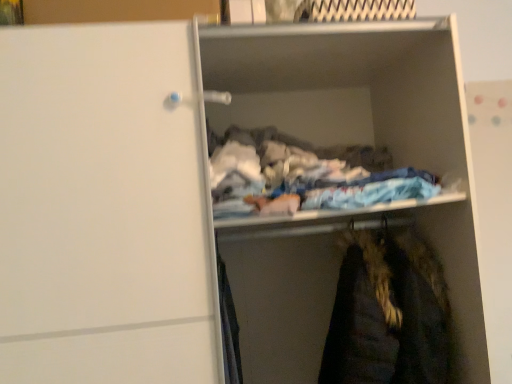
Question: Is velvet-like dark brown coat at lower right located outside white matte clothes at center?

Choices:
 (A) yes
 (B) no

Answer: (A)

Question: Would you consider velvet-like dark brown coat at lower right to be distant from white matte clothes at center?

Choices:
 (A) no
 (B) yes

Answer: (A)

Question: Is velvet-like dark brown coat at lower right closer to camera compared to white matte clothes at center?

Choices:
 (A) yes
 (B) no

Answer: (B)

Question: Can you see velvet-like dark brown coat at lower right touching white matte clothes at center?

Choices:
 (A) no
 (B) yes

Answer: (A)

Question: Considering the relative sizes of velvet-like dark brown coat at lower right and white matte clothes at center in the image provided, is velvet-like dark brown coat at lower right smaller than white matte clothes at center?

Choices:
 (A) no
 (B) yes

Answer: (B)

Question: Can you confirm if velvet-like dark brown coat at lower right is positioned to the right of white matte clothes at center?

Choices:
 (A) no
 (B) yes

Answer: (B)

Question: Is white matte clothes at center thinner than velvet-like dark brown coat at lower right?

Choices:
 (A) no
 (B) yes

Answer: (B)

Question: Is velvet-like dark brown coat at lower right inside white matte clothes at center?

Choices:
 (A) no
 (B) yes

Answer: (A)

Question: Does white matte clothes at center have a greater height compared to velvet-like dark brown coat at lower right?

Choices:
 (A) no
 (B) yes

Answer: (A)

Question: Considering the relative sizes of white matte clothes at center and velvet-like dark brown coat at lower right in the image provided, is white matte clothes at center smaller than velvet-like dark brown coat at lower right?

Choices:
 (A) no
 (B) yes

Answer: (A)

Question: Considering the relative positions of white matte clothes at center and velvet-like dark brown coat at lower right in the image provided, is white matte clothes at center to the right of velvet-like dark brown coat at lower right from the viewer's perspective?

Choices:
 (A) no
 (B) yes

Answer: (A)

Question: Is white matte clothes at center located outside velvet-like dark brown coat at lower right?

Choices:
 (A) no
 (B) yes

Answer: (B)

Question: Based on their sizes in the image, would you say white matte clothes at center is bigger or smaller than velvet-like dark brown coat at lower right?

Choices:
 (A) small
 (B) big

Answer: (B)